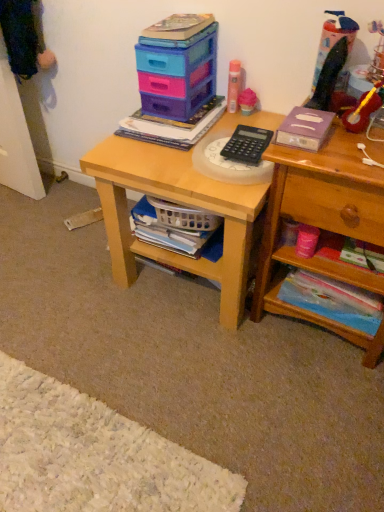
Locate an element on the screen. The image size is (384, 512). free space in front of purple matte book at upper right, the 2th book in the top-to-bottom sequence is located at coordinates (323, 158).